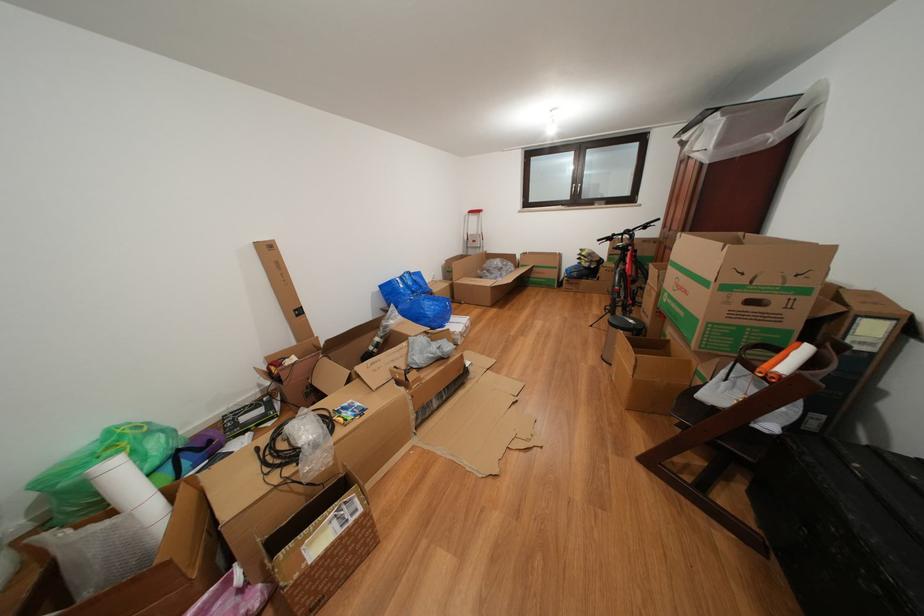
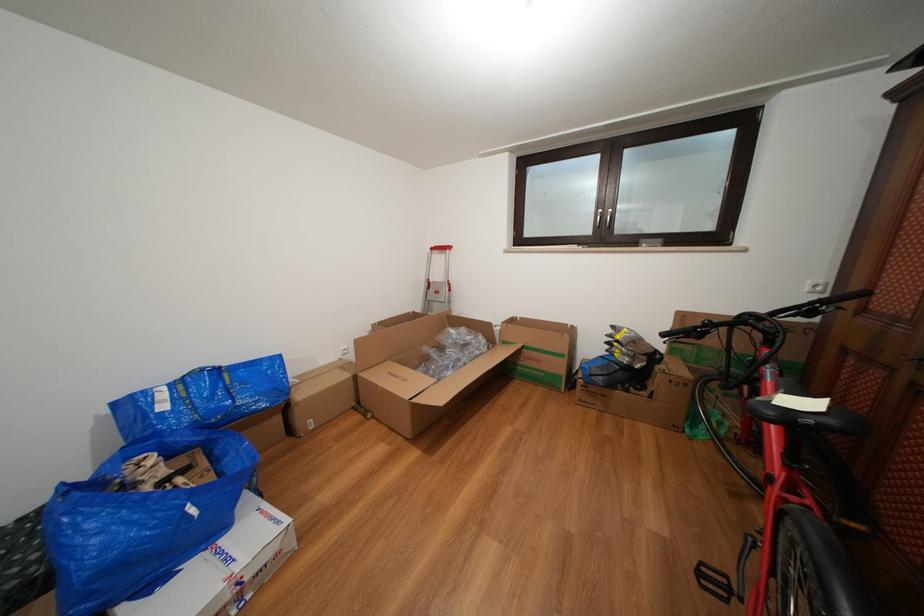
Locate, in the second image, the point that corresponds to point 418,278 in the first image.

(225, 376)